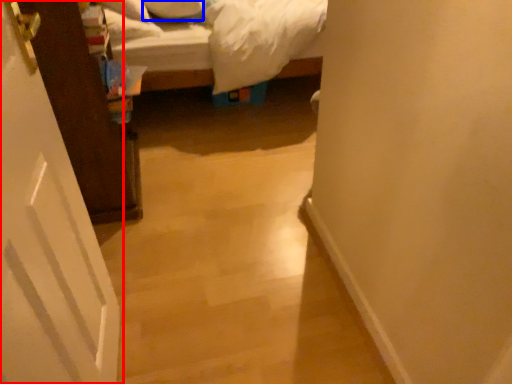
Question: Among these objects, which one is farthest to the camera, door (highlighted by a red box) or pillow (highlighted by a blue box)?

Choices:
 (A) door
 (B) pillow

Answer: (B)